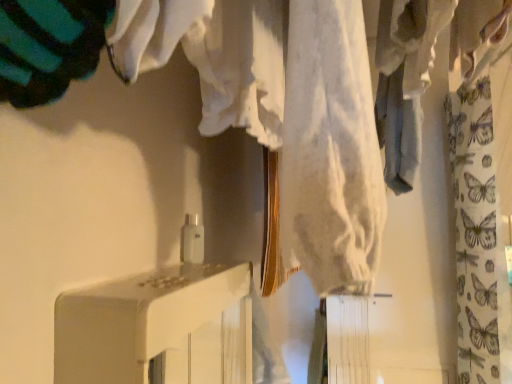
Question: Should I look upward or downward to see butterfly-patterned fabric at right?

Choices:
 (A) up
 (B) down

Answer: (B)

Question: From the image's perspective, does butterfly-patterned fabric at right appear higher than white glossy cabinet at center?

Choices:
 (A) yes
 (B) no

Answer: (A)

Question: Is butterfly-patterned fabric at right next to white glossy cabinet at center and touching it?

Choices:
 (A) yes
 (B) no

Answer: (B)

Question: Is the position of butterfly-patterned fabric at right less distant than that of white glossy cabinet at center?

Choices:
 (A) no
 (B) yes

Answer: (A)

Question: Does butterfly-patterned fabric at right have a lesser width compared to white glossy cabinet at center?

Choices:
 (A) no
 (B) yes

Answer: (A)

Question: Is butterfly-patterned fabric at right not within white glossy cabinet at center?

Choices:
 (A) yes
 (B) no

Answer: (A)

Question: Is butterfly-patterned fabric at right aimed at white glossy cabinet at center?

Choices:
 (A) yes
 (B) no

Answer: (B)

Question: From the image's perspective, is white glossy cabinet at center under butterfly-patterned fabric at right?

Choices:
 (A) yes
 (B) no

Answer: (A)

Question: Is white glossy cabinet at center taller than butterfly-patterned fabric at right?

Choices:
 (A) no
 (B) yes

Answer: (A)

Question: Can you confirm if white glossy cabinet at center is positioned to the right of butterfly-patterned fabric at right?

Choices:
 (A) no
 (B) yes

Answer: (A)

Question: Is white glossy cabinet at center facing towards butterfly-patterned fabric at right?

Choices:
 (A) no
 (B) yes

Answer: (A)

Question: Is the depth of white glossy cabinet at center less than that of butterfly-patterned fabric at right?

Choices:
 (A) no
 (B) yes

Answer: (B)

Question: Can you confirm if white glossy cabinet at center is bigger than butterfly-patterned fabric at right?

Choices:
 (A) no
 (B) yes

Answer: (A)

Question: In the image, is white glossy cabinet at center on the left side or the right side of butterfly-patterned fabric at right?

Choices:
 (A) left
 (B) right

Answer: (A)